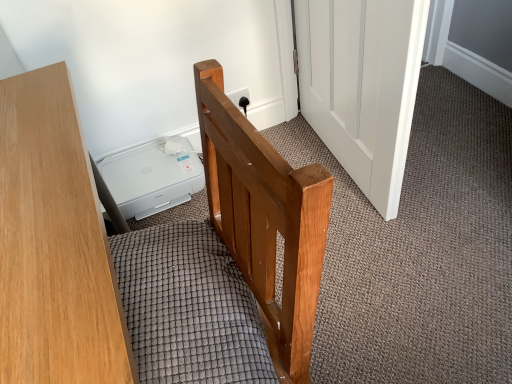
Question: Considering their positions, is textured gray mattress at center located in front of or behind wooden desk at left?

Choices:
 (A) front
 (B) behind

Answer: (B)

Question: From a real-world perspective, is textured gray mattress at center positioned above or below wooden desk at left?

Choices:
 (A) above
 (B) below

Answer: (A)

Question: Which object is positioned closest to the textured gray mattress at center?

Choices:
 (A) white wooden door at center
 (B) wooden desk at left

Answer: (B)

Question: Which object is the farthest from the white wooden door at center?

Choices:
 (A) wooden desk at left
 (B) textured gray mattress at center

Answer: (A)